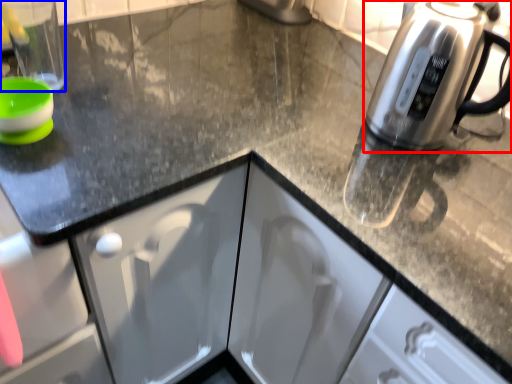
Question: Which object appears closest to the camera in this image, kettle (highlighted by a red box) or appliance (highlighted by a blue box)?

Choices:
 (A) kettle
 (B) appliance

Answer: (A)